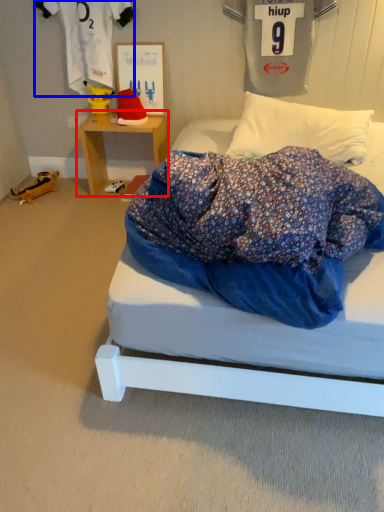
Question: Which object appears farthest to the camera in this image, table (highlighted by a red box) or clothing (highlighted by a blue box)?

Choices:
 (A) table
 (B) clothing

Answer: (A)